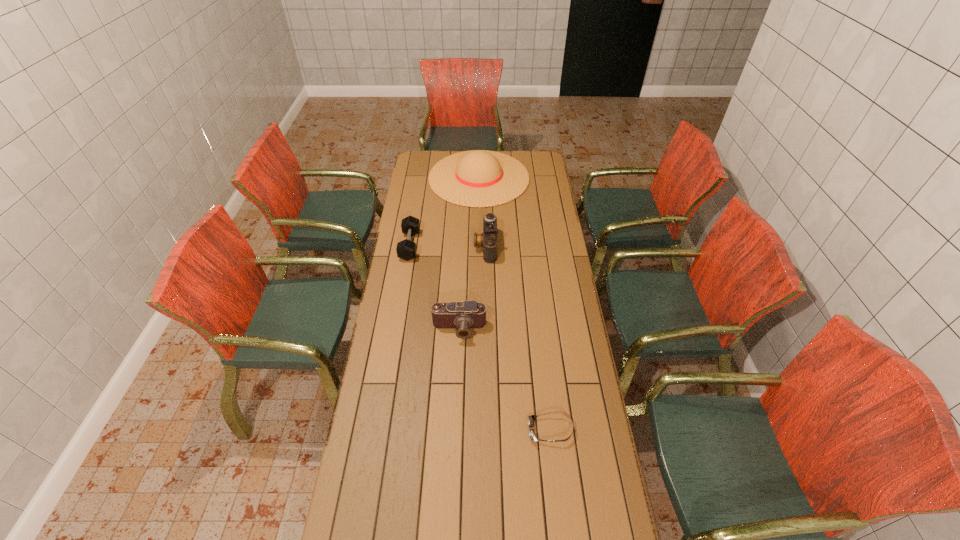
Identify the location of free space between the shortest object and the nearer camera. (505, 380).

The image size is (960, 540). Identify the location of blank region between the second nearest object and the farther camera. (472, 288).

The width and height of the screenshot is (960, 540). What are the coordinates of `blank region between the farther camera and the farthest object` in the screenshot? It's located at (483, 212).

Where is `free point between the farthest object and the farther camera`? free point between the farthest object and the farther camera is located at coordinates (483, 212).

What are the coordinates of `unoccupied position between the bonnet and the nearest object` in the screenshot? It's located at (515, 304).

Identify the location of unoccupied position between the tallest object and the nearer camera. This screenshot has height=540, width=960. (469, 253).

You are a GUI agent. You are given a task and a screenshot of the screen. Output one action in this format:
    pyautogui.click(x=<x>, y=<y>)
    Task: Click on the vacant area that lies between the nearest object and the nearer camera
    The height and width of the screenshot is (540, 960).
    Given the screenshot: What is the action you would take?
    pyautogui.click(x=505, y=380)

Locate an element on the screen. Image resolution: width=960 pixels, height=540 pixels. empty location between the farther camera and the nearer camera is located at coordinates (472, 288).

Identify which object is located as the nearest to the farther camera. Please provide its 2D coordinates. Your answer should be formatted as a tuple, i.e. [(x, y)], where the tuple contains the x and y coordinates of a point satisfying the conditions above.

[(477, 178)]

Where is `object identified as the third closest to the shortest object`? This screenshot has width=960, height=540. object identified as the third closest to the shortest object is located at coordinates (406, 249).